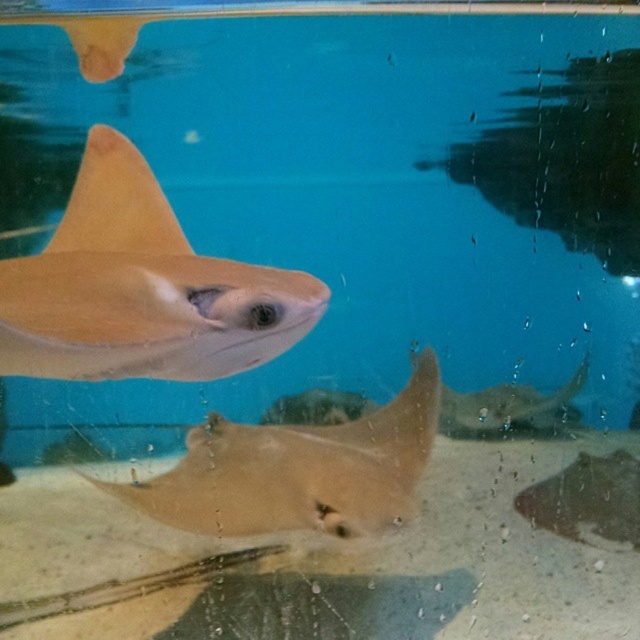
You are a marine biologist observing the stingrays from below. You notice a light brown matte stingray at upper left and a light tan smooth fin at upper left. Which object is nearer to your viewpoint?

The light brown matte stingray at upper left is closer to the viewer than the light tan smooth fin at upper left.

You are a diver swimming underwater and see the light brown matte stingray at upper left and the light brown matte stingray at center. Which stingray is nearer to you?

The light brown matte stingray at upper left is closer to the viewer than the light brown matte stingray at center.